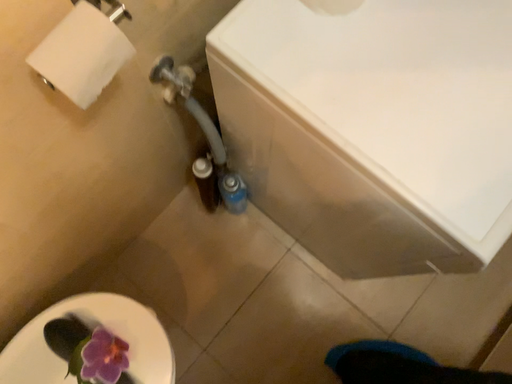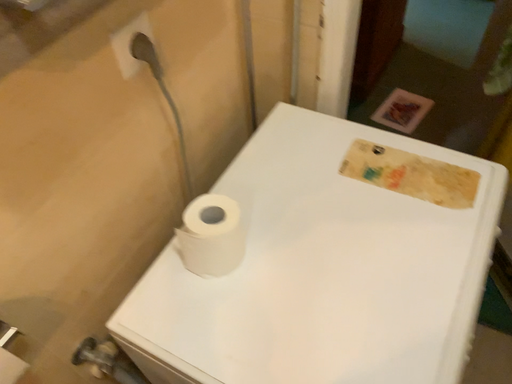
Question: How did the camera likely rotate when shooting the video?

Choices:
 (A) rotated downward
 (B) rotated upward

Answer: (B)